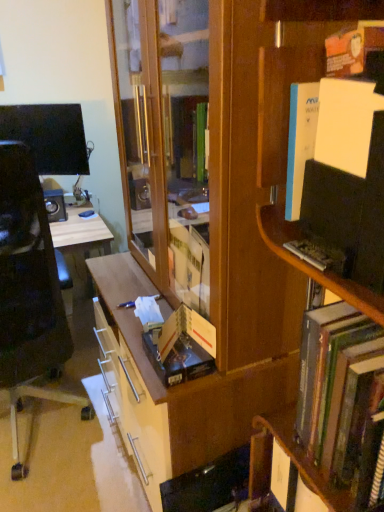
Question: Is wooden bookcase at center spatially inside wooden bookshelf at right, or outside of it?

Choices:
 (A) outside
 (B) inside

Answer: (A)

Question: Is wooden bookcase at center in front of or behind wooden bookshelf at right in the image?

Choices:
 (A) front
 (B) behind

Answer: (B)

Question: Estimate the real-world distances between objects in this image. Which object is farther from the hardcover book at right?

Choices:
 (A) hardcover book at center
 (B) black plastic chair at left
 (C) wooden bookshelf at right
 (D) wooden bookcase at center

Answer: (B)

Question: Which is farther from the wooden bookcase at center?

Choices:
 (A) hardcover book at center
 (B) wooden bookshelf at right
 (C) black plastic chair at left
 (D) hardcover book at right

Answer: (C)